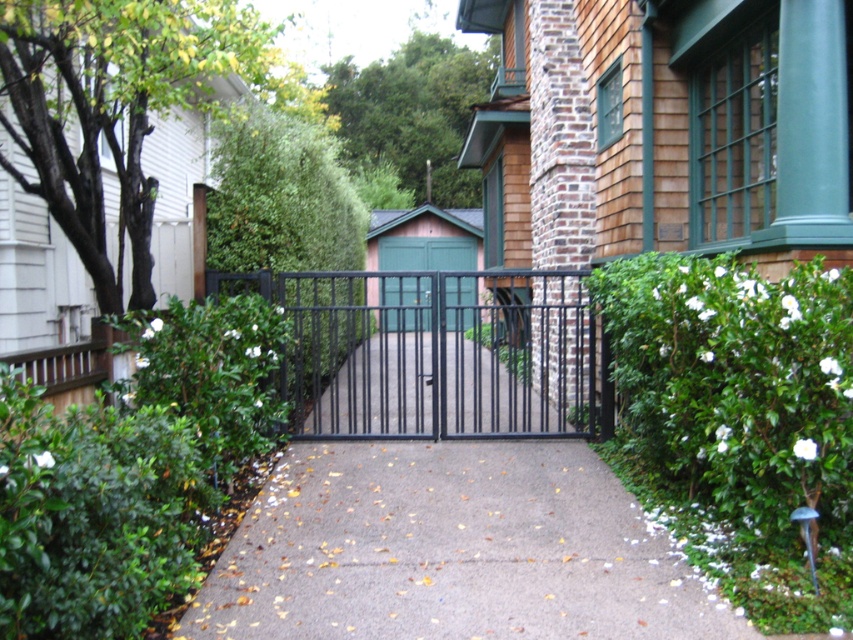
Question: Which point is farther to the camera?

Choices:
 (A) (561, 332)
 (B) (306, 291)
 (C) (843, 272)

Answer: (B)

Question: Is green leafy hedge at right behind green matte door at center?

Choices:
 (A) no
 (B) yes

Answer: (A)

Question: Which point appears closest to the camera in this image?

Choices:
 (A) (445, 280)
 (B) (552, 369)
 (C) (799, 417)
 (D) (274, 296)

Answer: (C)

Question: Does black metal gate at center have a smaller size compared to green leafy hedge at center?

Choices:
 (A) no
 (B) yes

Answer: (B)

Question: Which object appears farthest from the camera in this image?

Choices:
 (A) green matte door at center
 (B) green leafy hedge at right

Answer: (A)

Question: Does black metal gate at center appear over green leafy hedge at center?

Choices:
 (A) yes
 (B) no

Answer: (B)